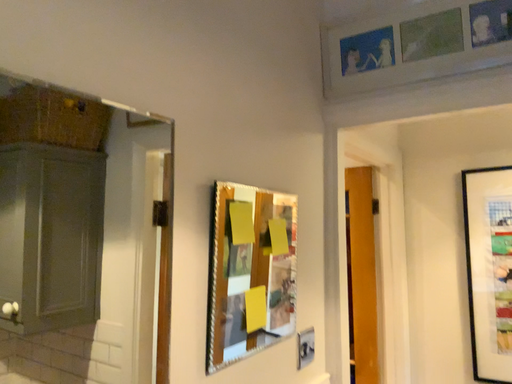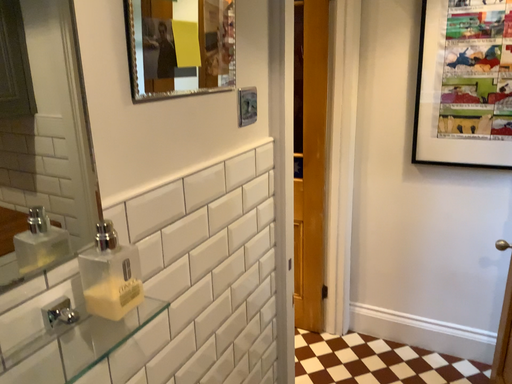
Question: Which way did the camera rotate in the video?

Choices:
 (A) rotated upward
 (B) rotated downward

Answer: (B)